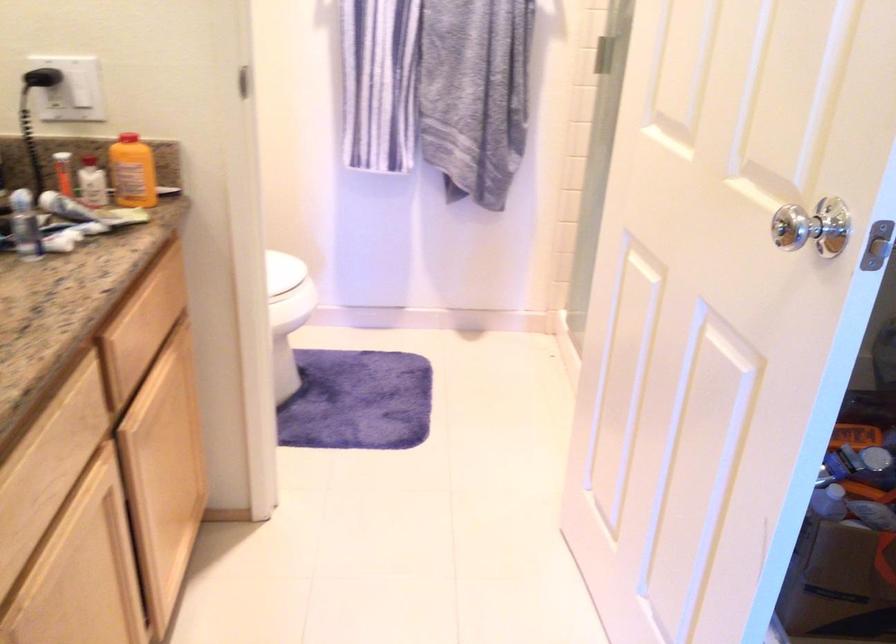
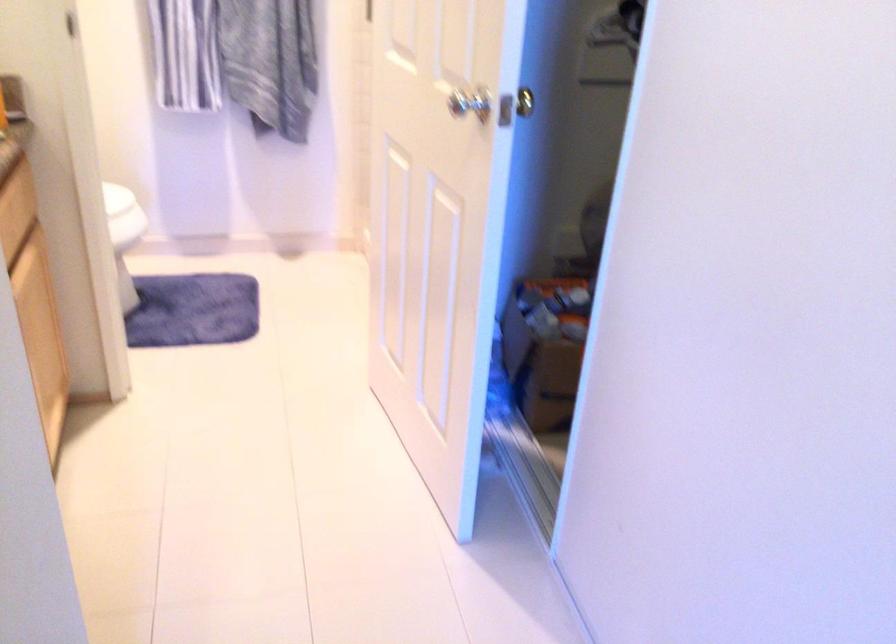
Question: What movement of the cameraman would produce the second image?

Choices:
 (A) Left
 (B) Right
 (C) Forward
 (D) Backward

Answer: (D)